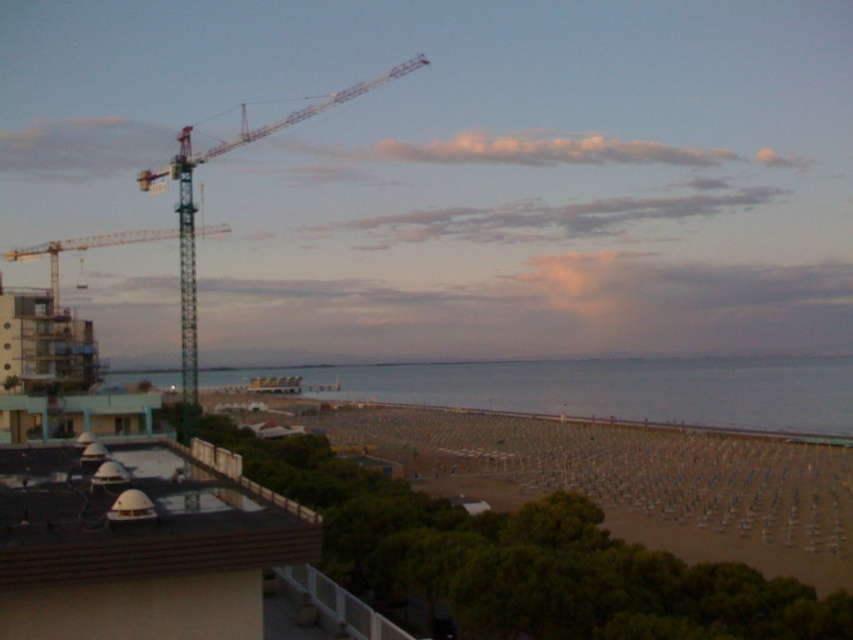
You are standing on the rooftop and want to place a large sculpture that requires a flat, elevated surface. Which location between the beige sand at lower right and the yellow metallic crane at upper left would be more suitable?

The yellow metallic crane at upper left is taller than the beige sand at lower right, so the crane provides a higher elevated surface. However, the beige sand at lower right might offer a flatter area. Since the sculpture needs a flat surface, the beige sand at lower right is more suitable.